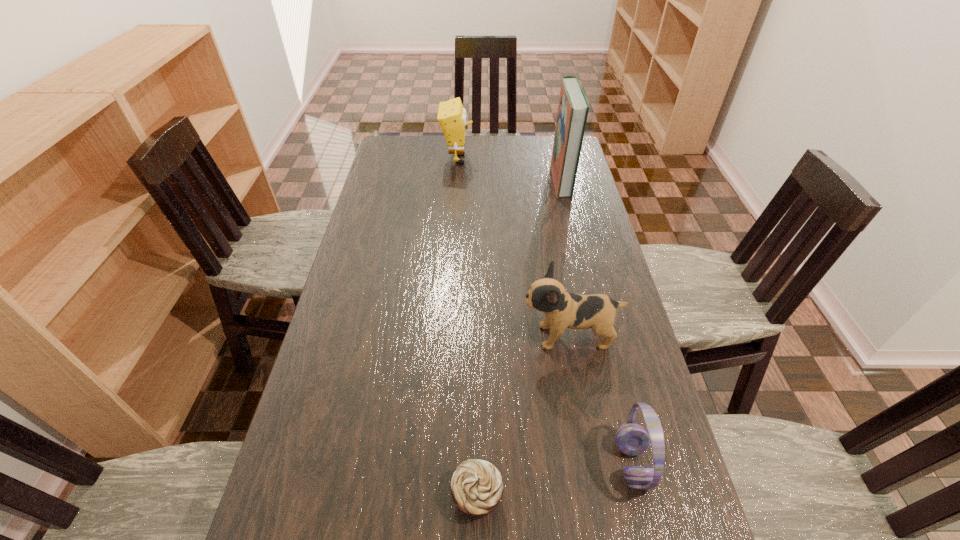
Find the location of a particular element. free spot between the sponge and the third nearest object is located at coordinates (513, 248).

Where is `vacant area that lies between the puppy and the shortest object`? vacant area that lies between the puppy and the shortest object is located at coordinates coord(523,416).

Locate which object ranks second in proximity to the third farthest object. Please provide its 2D coordinates. Your answer should be formatted as a tuple, i.e. [(x, y)], where the tuple contains the x and y coordinates of a point satisfying the conditions above.

[(476, 486)]

The height and width of the screenshot is (540, 960). Identify the location of object that can be found as the third closest to the headset. (573, 107).

Identify the location of vacant space that satisfies the following two spatial constraints: 1. on the cover of the hardback book; 2. on the front side of the shortest object. Image resolution: width=960 pixels, height=540 pixels. (635, 495).